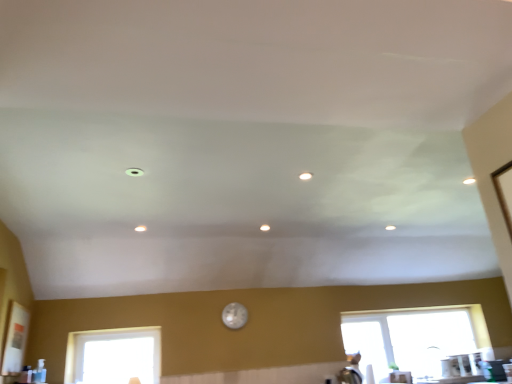
Question: Is point (106, 347) positioned closer to the camera than point (345, 329)?

Choices:
 (A) farther
 (B) closer

Answer: (B)

Question: Is transparent glass window at lower left, which appears as the first window when viewed from the left, situated inside transparent glass window at lower right, the first window in the back-to-front sequence, or outside?

Choices:
 (A) outside
 (B) inside

Answer: (A)

Question: Considering the real-world distances, which object is farthest from the transparent glass window at lower left, which is the 2th window from back to front?

Choices:
 (A) transparent glass window at lower right, the first window in the back-to-front sequence
 (B) pearl-like glass clock at center

Answer: (A)

Question: Which of these objects is positioned closest to the transparent glass window at lower right, positioned as the first window in right-to-left order?

Choices:
 (A) pearl-like glass clock at center
 (B) transparent glass window at lower left, the second window in the right-to-left sequence

Answer: (A)